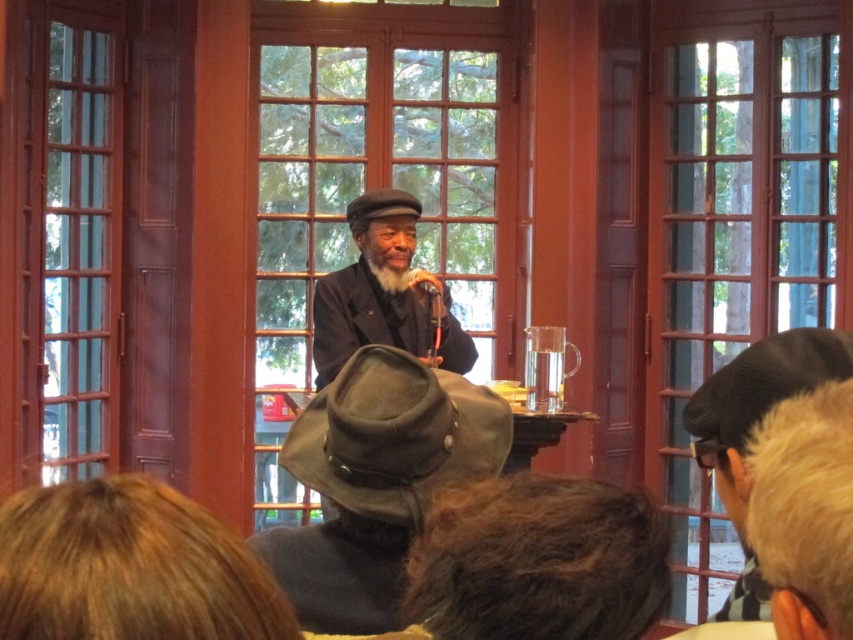
Does matte black hat at center appear over matte black microphone at center?

No, matte black hat at center is not above matte black microphone at center.

From the picture: Which of these two, matte black hat at center or matte black microphone at center, stands shorter?

Standing shorter between the two is matte black microphone at center.

Is point (318, 326) positioned after point (416, 289)?

No, (318, 326) is closer to viewer.

The image size is (853, 640). I want to click on matte black hat at center, so pos(372,285).